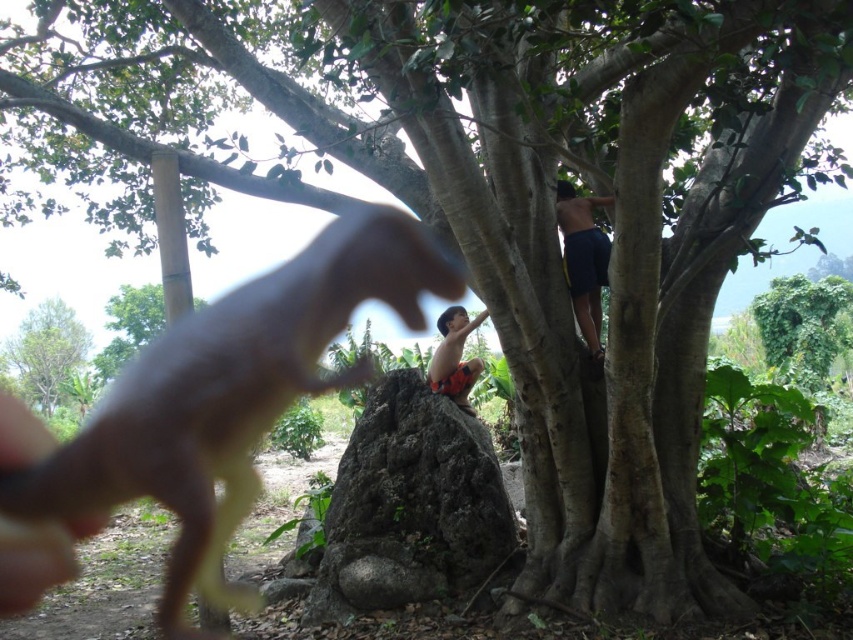
Question: Which object is farther from the camera taking this photo?

Choices:
 (A) gray rough rock at center
 (B) brown matte dinosaur at left
 (C) green leafy tree at upper left

Answer: (C)

Question: Is gray rough rock at center above dark blue shorts at upper right?

Choices:
 (A) no
 (B) yes

Answer: (A)

Question: Which object appears closest to the camera in this image?

Choices:
 (A) green leafy tree at upper left
 (B) brown matte dinosaur at left

Answer: (B)

Question: Is gray rough rock at center to the left of orange patterned shorts at center from the viewer's perspective?

Choices:
 (A) no
 (B) yes

Answer: (B)

Question: Can you confirm if gray rough rock at center is thinner than green leafy tree at upper left?

Choices:
 (A) yes
 (B) no

Answer: (A)

Question: Which of these objects is positioned closest to the orange patterned shorts at center?

Choices:
 (A) dark blue shorts at upper right
 (B) green leafy tree at upper left
 (C) brown matte dinosaur at left

Answer: (A)